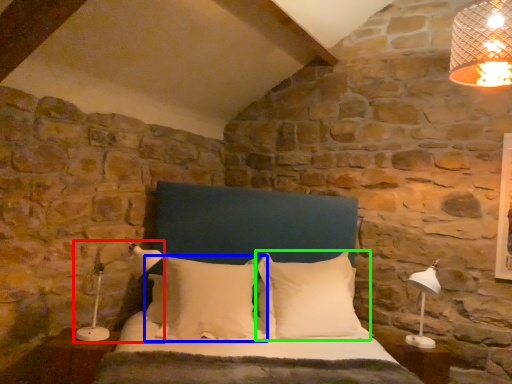
Question: Based on their relative distances, which object is farther from lamp (highlighted by a red box)? Choose from pillow (highlighted by a blue box) and pillow (highlighted by a green box).

Choices:
 (A) pillow
 (B) pillow

Answer: (B)